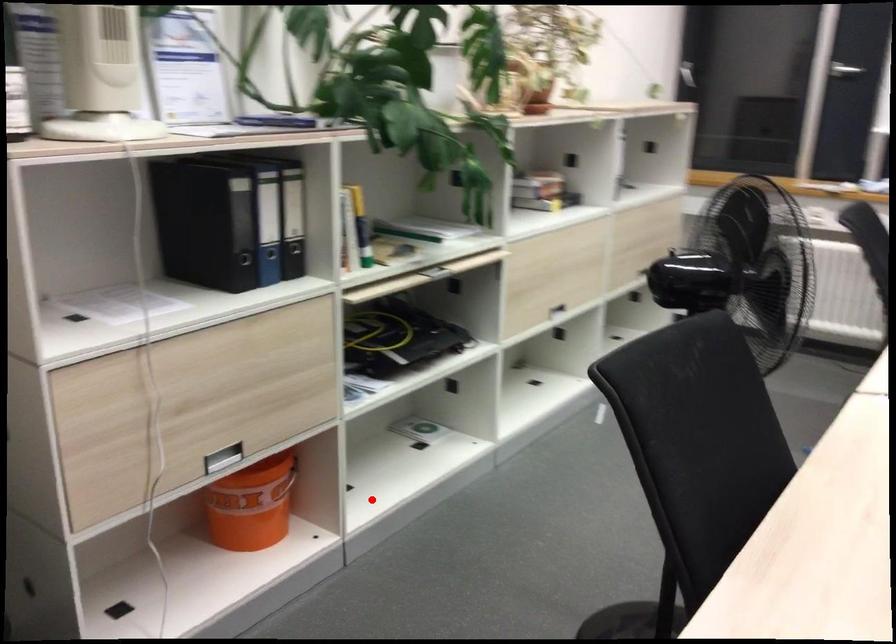
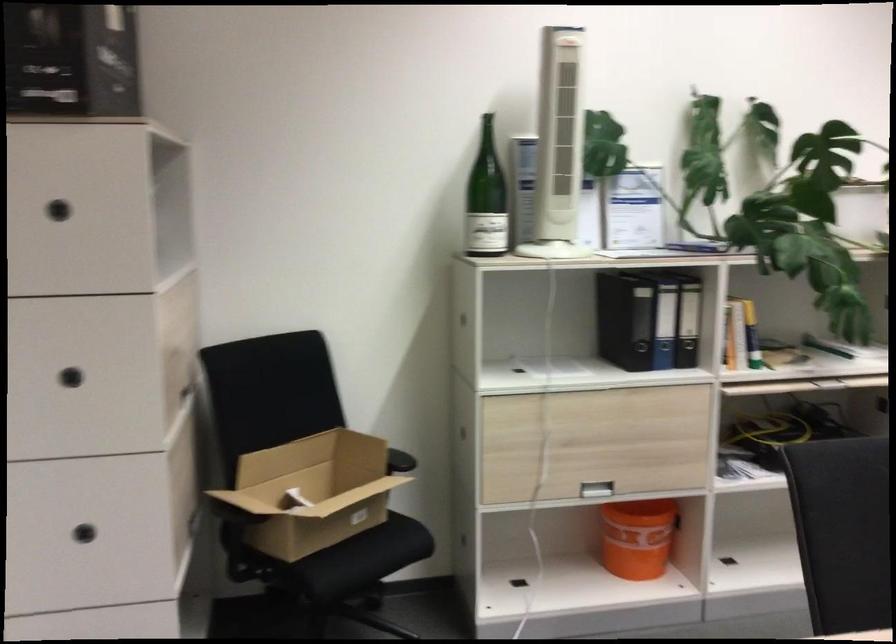
The point at the highlighted location is marked in the first image. Where is the corresponding point in the second image?

(738, 573)